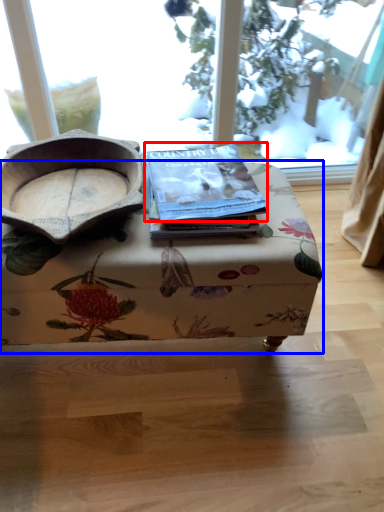
Question: Among these objects, which one is farthest to the camera, paperback book (highlighted by a red box) or table (highlighted by a blue box)?

Choices:
 (A) paperback book
 (B) table

Answer: (A)